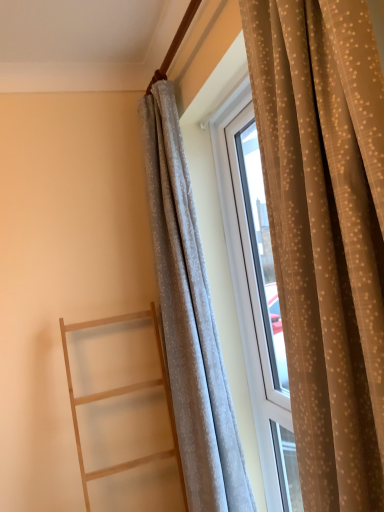
Question: Can you confirm if light gray sheer curtain at right, marked as the 2th curtain in a back-to-front arrangement, is positioned to the right of light wood ladder at left?

Choices:
 (A) no
 (B) yes

Answer: (B)

Question: Considering the relative sizes of light gray sheer curtain at right, positioned as the 1th curtain in front-to-back order, and light wood ladder at left in the image provided, is light gray sheer curtain at right, positioned as the 1th curtain in front-to-back order, thinner than light wood ladder at left?

Choices:
 (A) no
 (B) yes

Answer: (B)

Question: Is light gray sheer curtain at right, positioned as the 1th curtain in front-to-back order, next to light wood ladder at left and touching it?

Choices:
 (A) yes
 (B) no

Answer: (B)

Question: Does light gray sheer curtain at right, positioned as the 1th curtain in front-to-back order, turn towards light wood ladder at left?

Choices:
 (A) yes
 (B) no

Answer: (B)

Question: Can you confirm if light gray sheer curtain at right, marked as the 2th curtain in a back-to-front arrangement, is shorter than light wood ladder at left?

Choices:
 (A) yes
 (B) no

Answer: (B)

Question: Could light wood ladder at left be considered to be inside light gray sheer curtain at right, positioned as the 1th curtain in front-to-back order?

Choices:
 (A) yes
 (B) no

Answer: (B)

Question: Considering the relative sizes of light wood ladder at left and light gray sheer curtain at right, positioned as the 1th curtain in front-to-back order, in the image provided, is light wood ladder at left wider than light gray sheer curtain at right, positioned as the 1th curtain in front-to-back order,?

Choices:
 (A) no
 (B) yes

Answer: (B)

Question: Considering the relative sizes of light wood ladder at left and light gray sheer curtain at right, positioned as the 1th curtain in front-to-back order, in the image provided, is light wood ladder at left bigger than light gray sheer curtain at right, positioned as the 1th curtain in front-to-back order,?

Choices:
 (A) no
 (B) yes

Answer: (A)

Question: Is light wood ladder at left taller than light gray sheer curtain at right, positioned as the 1th curtain in front-to-back order?

Choices:
 (A) no
 (B) yes

Answer: (A)

Question: Is light gray sheer curtain at right, positioned as the 1th curtain in front-to-back order, at the back of light wood ladder at left?

Choices:
 (A) no
 (B) yes

Answer: (A)

Question: Is light wood ladder at left not within light gray sheer curtain at right, positioned as the 1th curtain in front-to-back order?

Choices:
 (A) no
 (B) yes

Answer: (B)

Question: From a real-world perspective, is light wood ladder at left over light gray sheer curtain at right, positioned as the 1th curtain in front-to-back order?

Choices:
 (A) no
 (B) yes

Answer: (A)

Question: Is white sheer curtain at center, positioned as the 1th curtain in back-to-front order, outside of light gray sheer curtain at right, marked as the 2th curtain in a back-to-front arrangement?

Choices:
 (A) no
 (B) yes

Answer: (B)